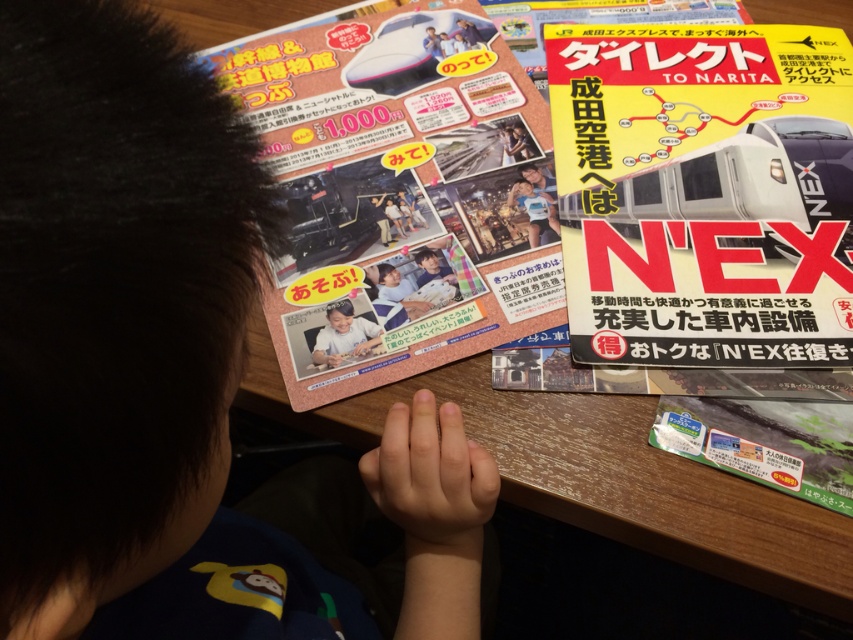
What is the 2D coordinate of the dark brown hair at upper left?

The dark brown hair at upper left is located at the 2D coordinate point of (131, 342).

You are a photographer trying to capture a close shot of the yellow paper magazine at upper right. You notice the dark brown hair at upper left is blocking your view. Can you move the hair out of the way without touching it?

The dark brown hair at upper left is closer to the viewer than the yellow paper magazine at upper right, so you cannot move the hair out of the way without moving closer or adjusting your angle since it is in front of the magazine.

You are organizing travel brochures on a table. You have a yellow paper magazine at upper right and a matte pink brochure at upper left. Which one is positioned more towards the right side of the table?

The yellow paper magazine at upper right is positioned more towards the right side of the table compared to the matte pink brochure at upper left.